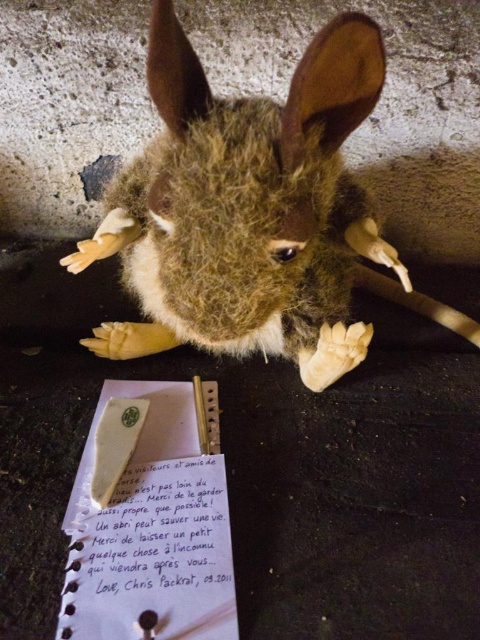
Can you confirm if fuzzy fur rabbit at center is bigger than white paper at center?

Yes, fuzzy fur rabbit at center is bigger than white paper at center.

Which of these two, fuzzy fur rabbit at center or white paper at center, stands taller?

fuzzy fur rabbit at center

You are a GUI agent. You are given a task and a screenshot of the screen. Output one action in this format:
    pyautogui.click(x=<x>, y=<y>)
    Task: Click on the fuzzy fur rabbit at center
    The image size is (480, 640).
    Given the screenshot: What is the action you would take?
    pyautogui.click(x=245, y=209)

The image size is (480, 640). Identify the location of fuzzy fur rabbit at center. (245, 209).